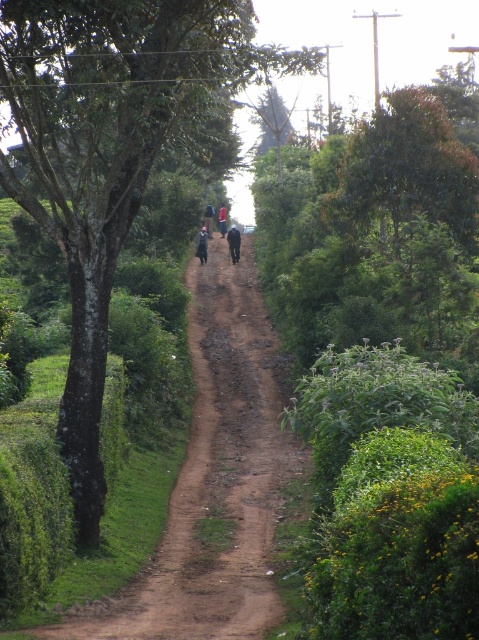
Question: Is green leafy tree at center positioned behind dark blue jacket at center?

Choices:
 (A) no
 (B) yes

Answer: (A)

Question: Estimate the real-world distances between objects in this image. Which object is farther from the blue fabric motorcyclist at center?

Choices:
 (A) green leafy tree at center
 (B) dark blue jacket at center
 (C) dark blue fabric at center

Answer: (A)

Question: Which of the following is the farthest from the observer?

Choices:
 (A) (339, 224)
 (B) (219, 225)

Answer: (B)

Question: Does green leafy tree at center come behind green leafy tree at upper right?

Choices:
 (A) no
 (B) yes

Answer: (A)

Question: Among these points, which one is nearest to the camera?

Choices:
 (A) (224, 212)
 (B) (205, 236)
 (C) (238, 259)
 (D) (463, 145)

Answer: (D)

Question: Can you confirm if green leafy tree at upper right is positioned to the left of black fabric person at center?

Choices:
 (A) yes
 (B) no

Answer: (B)